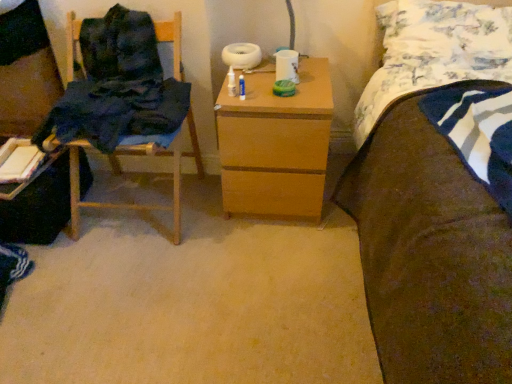
Question: Does wooden nightstand at center contain dark blue fabric at left?

Choices:
 (A) yes
 (B) no

Answer: (B)

Question: Can you confirm if wooden nightstand at center is smaller than dark blue fabric at left?

Choices:
 (A) yes
 (B) no

Answer: (B)

Question: Is wooden nightstand at center with dark blue fabric at left?

Choices:
 (A) no
 (B) yes

Answer: (A)

Question: Considering the relative positions of wooden nightstand at center and dark blue fabric at left in the image provided, is wooden nightstand at center to the left of dark blue fabric at left from the viewer's perspective?

Choices:
 (A) yes
 (B) no

Answer: (B)

Question: Considering the relative positions of wooden nightstand at center and dark blue fabric at left in the image provided, is wooden nightstand at center in front of dark blue fabric at left?

Choices:
 (A) yes
 (B) no

Answer: (B)

Question: Considering their positions, is dark blue fabric chair at left located in front of or behind wooden nightstand at center?

Choices:
 (A) behind
 (B) front

Answer: (A)

Question: In terms of width, does dark blue fabric chair at left look wider or thinner when compared to wooden nightstand at center?

Choices:
 (A) thin
 (B) wide

Answer: (A)

Question: Is point (50, 223) positioned closer to the camera than point (231, 134)?

Choices:
 (A) closer
 (B) farther

Answer: (B)

Question: Is dark blue fabric chair at left bigger or smaller than wooden nightstand at center?

Choices:
 (A) big
 (B) small

Answer: (B)

Question: Is dark blue fabric chair at left taller or shorter than floral fabric pillow at upper right?

Choices:
 (A) short
 (B) tall

Answer: (B)

Question: Visually, is dark blue fabric chair at left positioned to the left or to the right of floral fabric pillow at upper right?

Choices:
 (A) left
 (B) right

Answer: (A)

Question: Considering their positions, is dark blue fabric chair at left located in front of or behind floral fabric pillow at upper right?

Choices:
 (A) behind
 (B) front

Answer: (A)

Question: Considering the positions of point (24, 97) and point (392, 39), is point (24, 97) closer or farther from the camera than point (392, 39)?

Choices:
 (A) farther
 (B) closer

Answer: (A)

Question: Considering the positions of wooden nightstand at center and brown fabric bed at right in the image, is wooden nightstand at center bigger or smaller than brown fabric bed at right?

Choices:
 (A) big
 (B) small

Answer: (B)

Question: From the image's perspective, is wooden nightstand at center positioned above or below brown fabric bed at right?

Choices:
 (A) above
 (B) below

Answer: (A)